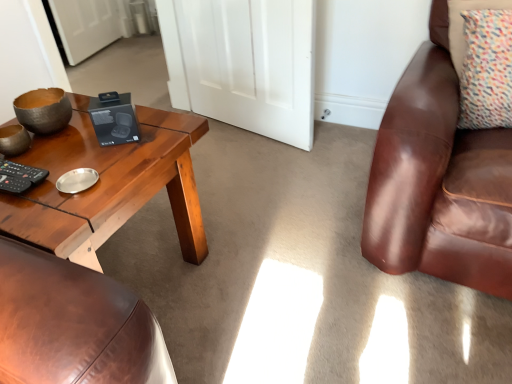
Question: Is woodenmaterial/texturecoffee table at left in contact with white matte door at center?

Choices:
 (A) no
 (B) yes

Answer: (A)

Question: From the image's perspective, is woodenmaterial/texturecoffee table at left below white matte door at center?

Choices:
 (A) yes
 (B) no

Answer: (A)

Question: Does woodenmaterial/texturecoffee table at left appear on the left side of white matte door at center?

Choices:
 (A) no
 (B) yes

Answer: (B)

Question: Is woodenmaterial/texturecoffee table at left not within white matte door at center?

Choices:
 (A) yes
 (B) no

Answer: (A)

Question: Is woodenmaterial/texturecoffee table at left positioned before white matte door at center?

Choices:
 (A) yes
 (B) no

Answer: (A)

Question: Is woodenmaterial/texturecoffee table at left taller than white matte door at center?

Choices:
 (A) yes
 (B) no

Answer: (B)

Question: Is the position of multicolored fabric pillow at upper right more distant than that of white matte door at center?

Choices:
 (A) no
 (B) yes

Answer: (A)

Question: Is multicolored fabric pillow at upper right positioned before white matte door at center?

Choices:
 (A) yes
 (B) no

Answer: (A)

Question: Is multicolored fabric pillow at upper right outside white matte door at center?

Choices:
 (A) no
 (B) yes

Answer: (B)

Question: Is the surface of multicolored fabric pillow at upper right in direct contact with white matte door at center?

Choices:
 (A) no
 (B) yes

Answer: (A)

Question: Does multicolored fabric pillow at upper right have a lesser height compared to white matte door at center?

Choices:
 (A) no
 (B) yes

Answer: (B)

Question: Is multicolored fabric pillow at upper right surrounding white matte door at center?

Choices:
 (A) yes
 (B) no

Answer: (B)

Question: From the image's perspective, is woodenmaterial/texturecoffee table at left over multicolored fabric pillow at upper right?

Choices:
 (A) no
 (B) yes

Answer: (A)